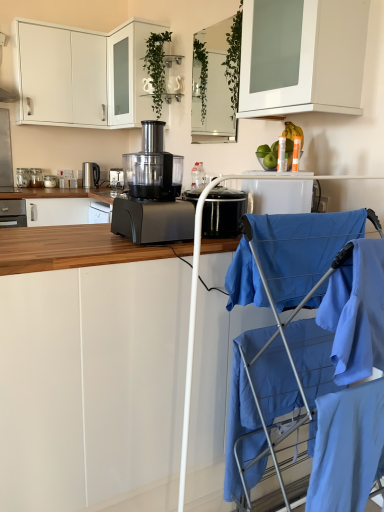
Question: Should I look upward or downward to see white glossy cabinet at upper center, the 4th cabinetry positioned from the bottom?

Choices:
 (A) up
 (B) down

Answer: (A)

Question: Is white glossy cabinet at upper left, the fifth cabinetry when ordered from bottom to top, positioned before green leafy plant at upper center?

Choices:
 (A) yes
 (B) no

Answer: (A)

Question: Can you confirm if white glossy cabinet at upper left, the fifth cabinetry when ordered from bottom to top, is thinner than green leafy plant at upper center?

Choices:
 (A) no
 (B) yes

Answer: (A)

Question: From a real-world perspective, is white glossy cabinet at upper left, the fifth cabinetry when ordered from bottom to top, located beneath green leafy plant at upper center?

Choices:
 (A) no
 (B) yes

Answer: (B)

Question: Is white glossy cabinet at upper left, the 1th cabinetry viewed from the top, looking in the opposite direction of green leafy plant at upper center?

Choices:
 (A) no
 (B) yes

Answer: (A)

Question: Considering the relative positions of white glossy cabinet at upper left, the 1th cabinetry viewed from the top, and green leafy plant at upper center in the image provided, is white glossy cabinet at upper left, the 1th cabinetry viewed from the top, to the right of green leafy plant at upper center from the viewer's perspective?

Choices:
 (A) no
 (B) yes

Answer: (A)

Question: Is white glossy cabinet at upper left, the fifth cabinetry when ordered from bottom to top, touching green leafy plant at upper center?

Choices:
 (A) no
 (B) yes

Answer: (A)

Question: Is metallic silver toaster at left, the third kitchen appliance when ordered from left to right, not close to clear glass mirror at upper center, which ranks as the third cabinetry in top-to-bottom order?

Choices:
 (A) yes
 (B) no

Answer: (A)

Question: From the image's perspective, is metallic silver toaster at left, the third kitchen appliance when ordered from left to right, below clear glass mirror at upper center, which ranks as the third cabinetry in top-to-bottom order?

Choices:
 (A) no
 (B) yes

Answer: (B)

Question: Is metallic silver toaster at left, placed as the third kitchen appliance when sorted from right to left, taller than clear glass mirror at upper center, which ranks as the third cabinetry in top-to-bottom order?

Choices:
 (A) no
 (B) yes

Answer: (A)

Question: From a real-world perspective, does metallic silver toaster at left, placed as the third kitchen appliance when sorted from right to left, stand above clear glass mirror at upper center, the third cabinetry from the bottom?

Choices:
 (A) no
 (B) yes

Answer: (A)

Question: Considering the relative sizes of metallic silver toaster at left, placed as the third kitchen appliance when sorted from right to left, and clear glass mirror at upper center, which ranks as the third cabinetry in top-to-bottom order, in the image provided, is metallic silver toaster at left, placed as the third kitchen appliance when sorted from right to left, shorter than clear glass mirror at upper center, which ranks as the third cabinetry in top-to-bottom order,?

Choices:
 (A) no
 (B) yes

Answer: (B)

Question: Could you tell me if metallic silver toaster at left, positioned as the 1th kitchen appliance in back-to-front order, is facing clear glass mirror at upper center, which ranks as the third cabinetry in top-to-bottom order?

Choices:
 (A) yes
 (B) no

Answer: (B)

Question: Is black plastic food processor at center, positioned as the 5th kitchen appliance in back-to-front order, far away from white glossy cabinet at upper center, marked as the second cabinetry in a top-to-bottom arrangement?

Choices:
 (A) no
 (B) yes

Answer: (B)